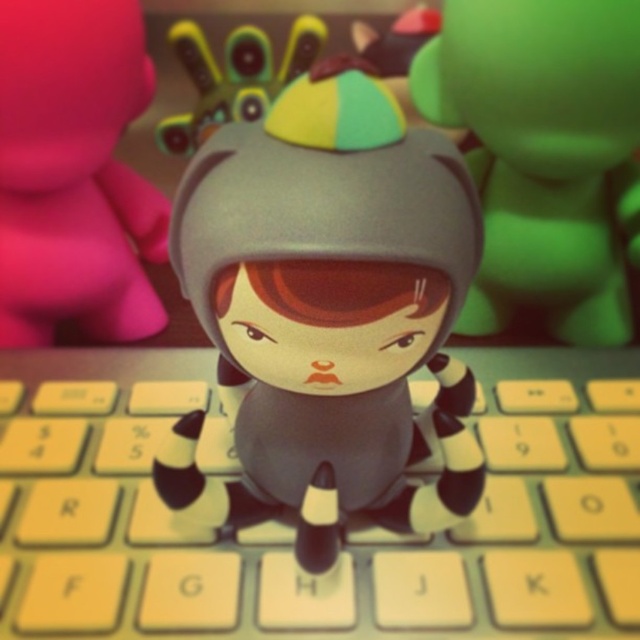
Does yellow plastic keyboard at center have a lesser width compared to matte gray helmet at center?

No, yellow plastic keyboard at center is not thinner than matte gray helmet at center.

What are the coordinates of `yellow plastic keyboard at center` in the screenshot? It's located at (x=292, y=528).

Where is `yellow plastic keyboard at center`? yellow plastic keyboard at center is located at coordinates (292, 528).

Based on the photo, can you confirm if matte black toy at center is thinner than matte pink toy at upper left?

In fact, matte black toy at center might be wider than matte pink toy at upper left.

Can you confirm if matte black toy at center is positioned to the right of matte pink toy at upper left?

Correct, you'll find matte black toy at center to the right of matte pink toy at upper left.

Does point (333, 220) lie in front of point (132, 116)?

Yes, it is.

Where is `matte black toy at center`? Image resolution: width=640 pixels, height=640 pixels. matte black toy at center is located at coordinates (333, 296).

Which is above, matte gray helmet at center or matte pink toy at upper left?

matte gray helmet at center is higher up.

Between matte gray helmet at center and matte pink toy at upper left, which one has less height?

matte pink toy at upper left

Which is behind, point (513, 196) or point (116, 224)?

Positioned behind is point (116, 224).

At what (x,y) coordinates should I click in order to perform the action: click on matte gray helmet at center. Please return your answer as a coordinate pair (x, y). Image resolution: width=640 pixels, height=640 pixels. Looking at the image, I should click on (544, 154).